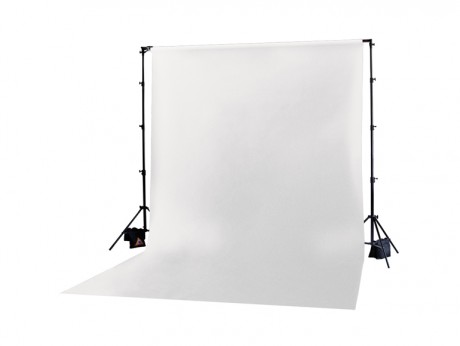
Locate an element on the screen. backdrop is located at coordinates (304, 157).